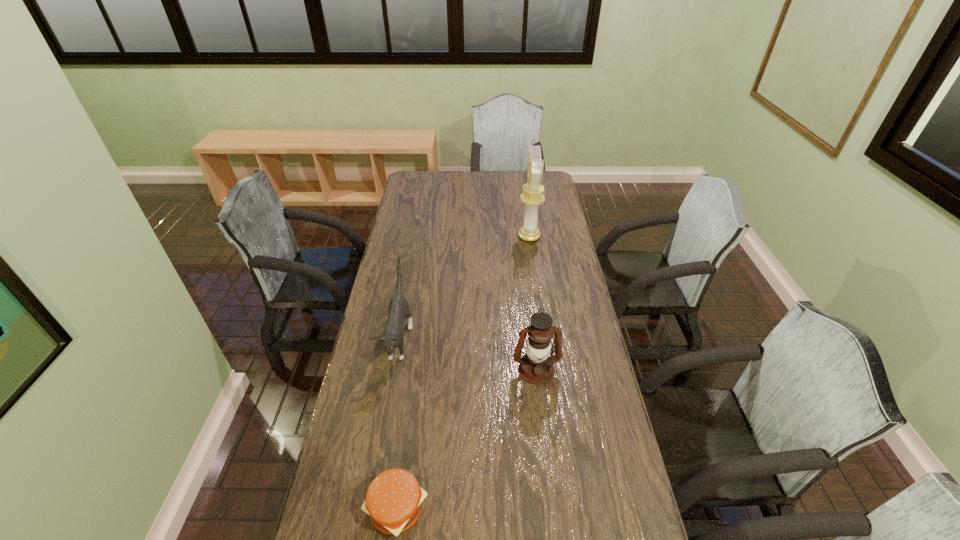
This screenshot has width=960, height=540. I want to click on award present at the right edge, so click(532, 196).

You are a GUI agent. You are given a task and a screenshot of the screen. Output one action in this format:
    pyautogui.click(x=<x>, y=<y>)
    Task: Click on the lantern at the right edge
    The image size is (960, 540).
    Given the screenshot: What is the action you would take?
    pyautogui.click(x=536, y=367)

Where is `vacant area at the far edge`? This screenshot has height=540, width=960. vacant area at the far edge is located at coordinates pos(484,178).

Locate an element on the screen. This screenshot has width=960, height=540. vacant space at the left edge is located at coordinates (409, 198).

Where is `vacant space at the right edge of the desktop`? The height and width of the screenshot is (540, 960). vacant space at the right edge of the desktop is located at coordinates [x=558, y=303].

Find the location of a particular element. The image size is (960, 540). vacant space that's between the farthest object and the third tallest object is located at coordinates (465, 288).

Find the location of a particular element. The height and width of the screenshot is (540, 960). vacant space that's between the lantern and the farthest object is located at coordinates (533, 303).

The width and height of the screenshot is (960, 540). Identify the location of vacant area between the cat and the lantern. (468, 354).

Locate an element on the screen. Image resolution: width=960 pixels, height=540 pixels. the second closest object to the third tallest object is located at coordinates (536, 367).

Locate an element on the screen. object that ranks as the second closest to the hamburger is located at coordinates (536, 367).